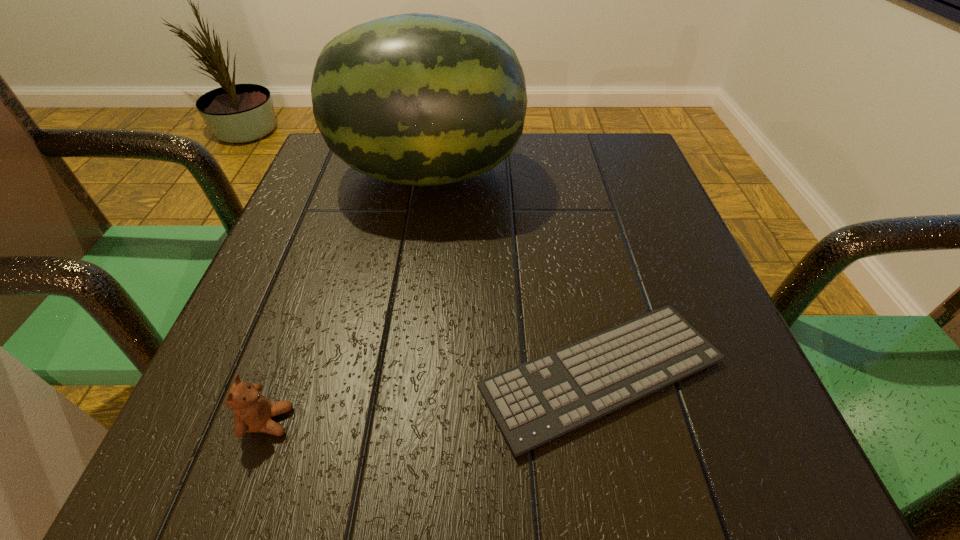
The height and width of the screenshot is (540, 960). What are the coordinates of `vacant space at the far right corner of the desktop` in the screenshot? It's located at (608, 185).

Locate an element on the screen. Image resolution: width=960 pixels, height=540 pixels. unoccupied position between the shortest object and the teddy bear is located at coordinates (435, 397).

The height and width of the screenshot is (540, 960). What are the coordinates of `empty space between the tallest object and the shortest object` in the screenshot? It's located at (515, 273).

The image size is (960, 540). In order to click on free space between the tallest object and the shortest object in this screenshot , I will do `click(515, 273)`.

This screenshot has height=540, width=960. I want to click on free space between the teddy bear and the shortest object, so (x=435, y=397).

The height and width of the screenshot is (540, 960). I want to click on vacant region between the computer keyboard and the second tallest object, so click(x=435, y=397).

Locate an element on the screen. This screenshot has height=540, width=960. free space between the computer keyboard and the second shortest object is located at coordinates (435, 397).

You are a GUI agent. You are given a task and a screenshot of the screen. Output one action in this format:
    pyautogui.click(x=<x>, y=<y>)
    Task: Click on the free space between the second shortest object and the tallest object
    The height and width of the screenshot is (540, 960).
    Given the screenshot: What is the action you would take?
    pyautogui.click(x=348, y=297)

Image resolution: width=960 pixels, height=540 pixels. I want to click on vacant point located between the tallest object and the second tallest object, so click(348, 297).

Find the location of `unoccupied area between the second tallest object and the watermelon`. unoccupied area between the second tallest object and the watermelon is located at coordinates (348, 297).